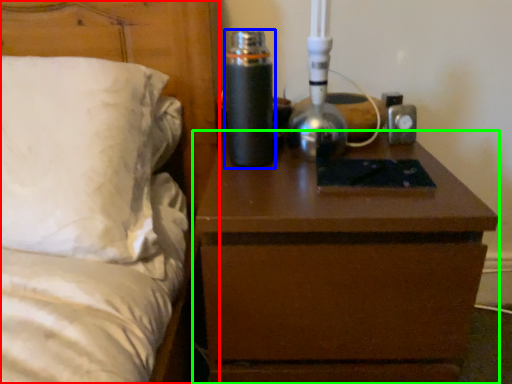
Question: Considering the real-world distances, which object is farthest from bed (highlighted by a red box)? bottle (highlighted by a blue box) or nightstand (highlighted by a green box)?

Choices:
 (A) bottle
 (B) nightstand

Answer: (B)